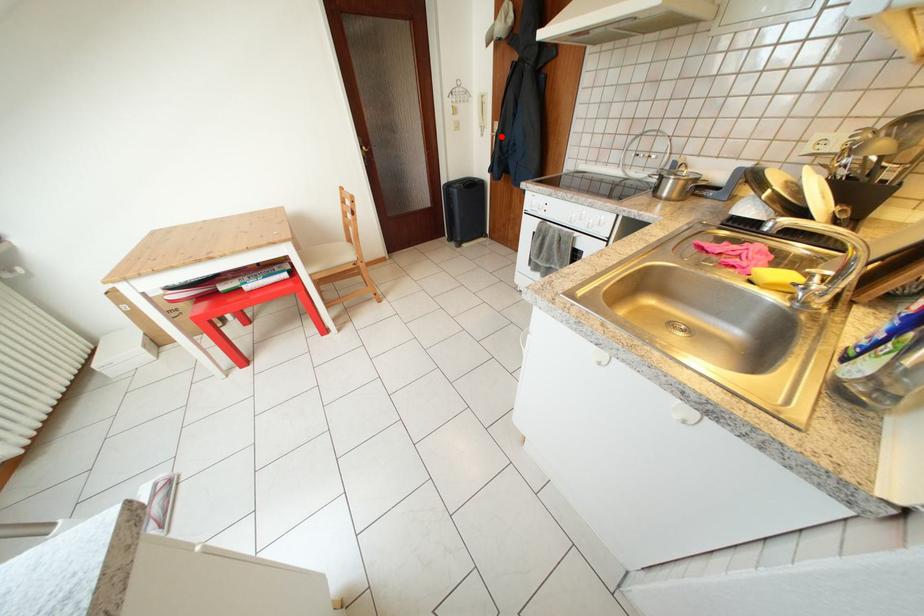
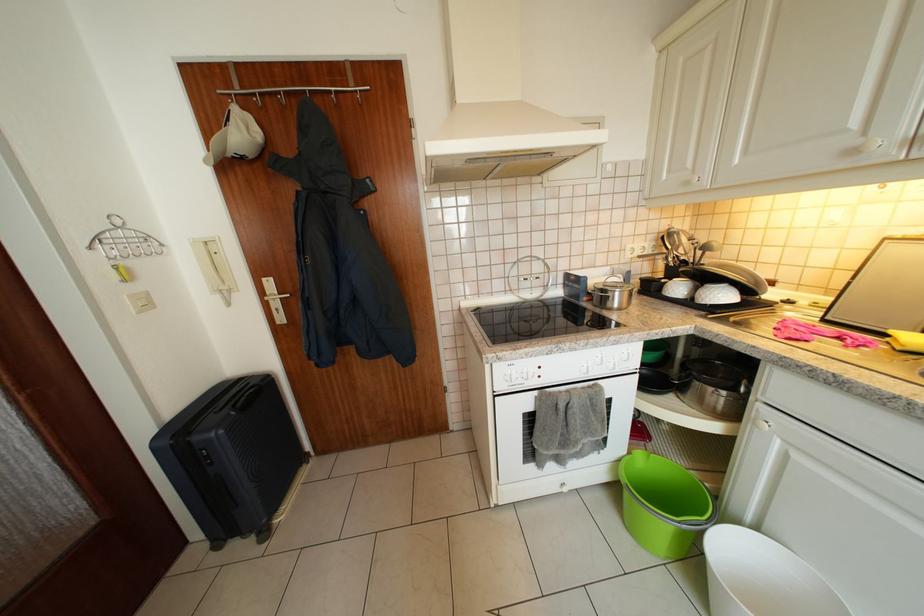
Find the pixel in the second image that matches the highlighted location in the first image.

(271, 299)